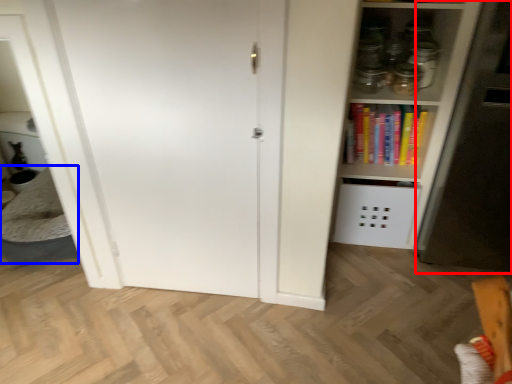
Question: Which of the following is the closest to the observer, fridge (highlighted by a red box) or table (highlighted by a blue box)?

Choices:
 (A) fridge
 (B) table

Answer: (A)